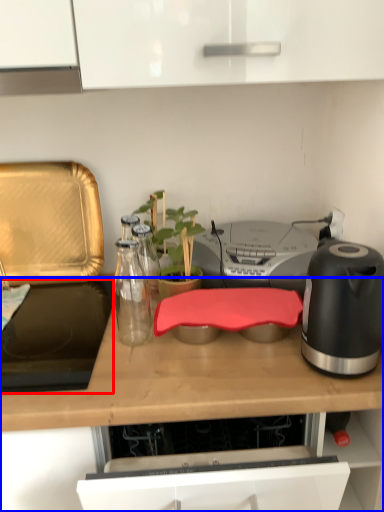
Question: Which point is further to the camera, gas stove (highlighted by a red box) or countertop (highlighted by a blue box)?

Choices:
 (A) gas stove
 (B) countertop

Answer: (A)